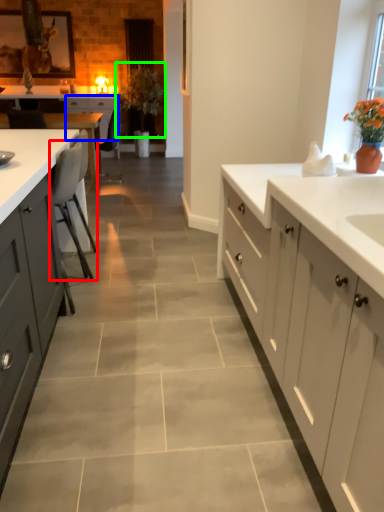
Question: Considering the real-world distances, which object is closest to chair (highlighted by a red box)? cabinetry (highlighted by a blue box) or plant (highlighted by a green box).

Choices:
 (A) cabinetry
 (B) plant

Answer: (A)